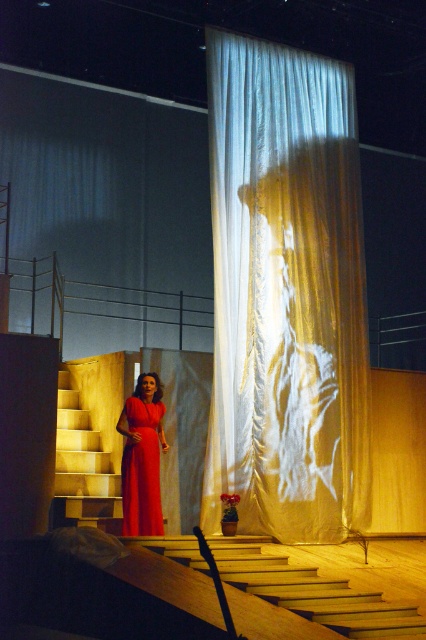
Looking at this image, you are an actor standing on the stage and need to exit through the backstage door located behind the light wood stairs at lower left. To avoid blocking the audience view of the white sheer curtain at center, which object should you move behind first?

You should move behind the white sheer curtain at center first because it is closer to the viewer than the light wood stairs at lower left, so positioning yourself behind it would hide you from the audience while moving towards the stairs.

You are an actor positioned on the stage and need to exit through the back door located at the far left. The white sheer curtain at center is in your path. Can you walk around it without touching it, given that you have a 0.5 meters clearance requirement?

The white sheer curtain at center is located at point (285,294). Since the curtain is positioned centrally, you can walk around it by moving either to the left or right side, maintaining the required 0.5 meters clearance as there is space available on both sides of the curtain.

You are an actor positioned at the back of the stage. You need to quickly move to the wooden stairs at lower left and then to the matte red dress at center. Which object will you reach first?

You will reach the wooden stairs at lower left first because it is closer to you than the matte red dress at center.